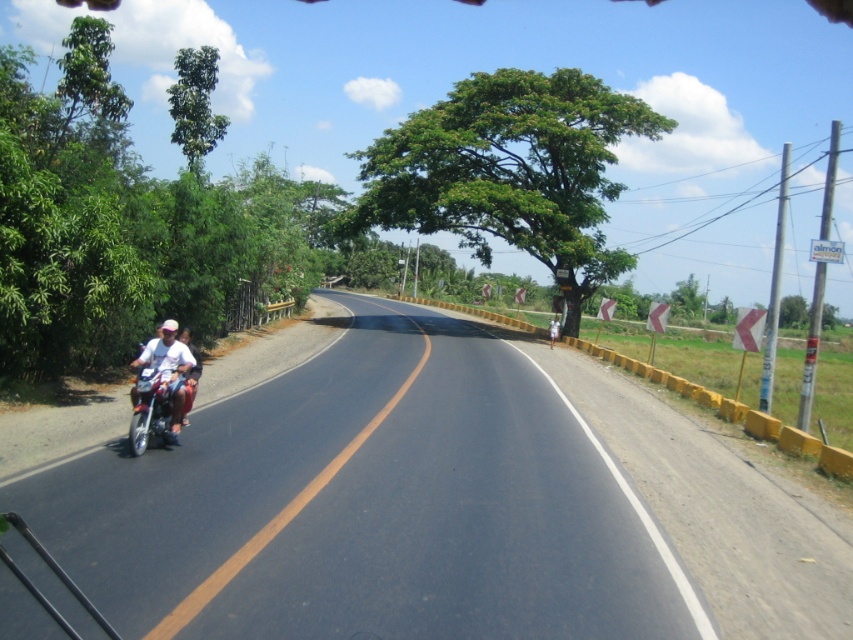
Question: Can you confirm if black asphalt road at left is bigger than metallic silver motorcycle at left?

Choices:
 (A) yes
 (B) no

Answer: (A)

Question: Which object is the closest to the black asphalt road at left?

Choices:
 (A) metallic silver motorcycle at left
 (B) white matte motorcycle at left

Answer: (B)

Question: Does black asphalt road at left have a greater width compared to metallic silver motorcycle at left?

Choices:
 (A) yes
 (B) no

Answer: (A)

Question: Among these points, which one is nearest to the camera?

Choices:
 (A) (671, 476)
 (B) (171, 340)

Answer: (A)

Question: Can you confirm if metallic silver motorcycle at left is positioned to the right of white matte motorcycle at left?

Choices:
 (A) no
 (B) yes

Answer: (B)

Question: Which point is farther to the camera?

Choices:
 (A) (187, 371)
 (B) (433, 360)

Answer: (B)